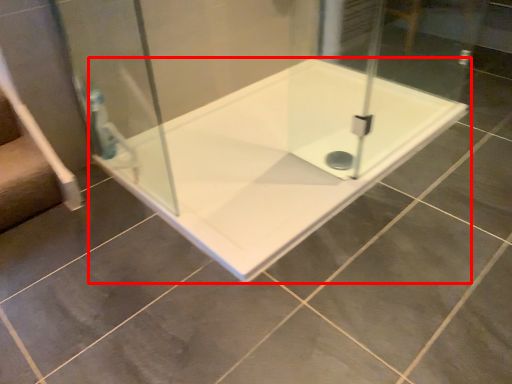
Question: From the image's perspective, considering the relative positions of bathtub (annotated by the red box) and shower door in the image provided, where is bathtub (annotated by the red box) located with respect to the staircase?

Choices:
 (A) below
 (B) above

Answer: (A)